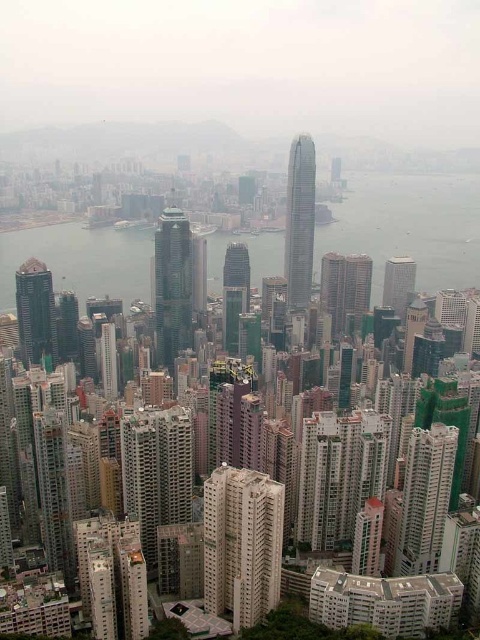
You are a city planner analyzing this urban layout. You notice the beige concrete building at center and the green glass skyscraper at center. Which of these two structures has a greater height according to the architectural plans?

The green glass skyscraper at center is taller than the beige concrete building at center, so it has a greater height.

You are a drone operator tasked with delivering a package to the green glass skyscraper at center. The delivery zone requires you to approach within a 0.1 unit radius of its coordinates. Can you confirm if your current position at point 0.45, 0.36 is within the required radius?

The green glass skyscraper at center is located at point (171, 285). Your current position at (172, 288) is within 0.1 unit radius of the skyscraper, so you can proceed with the delivery.